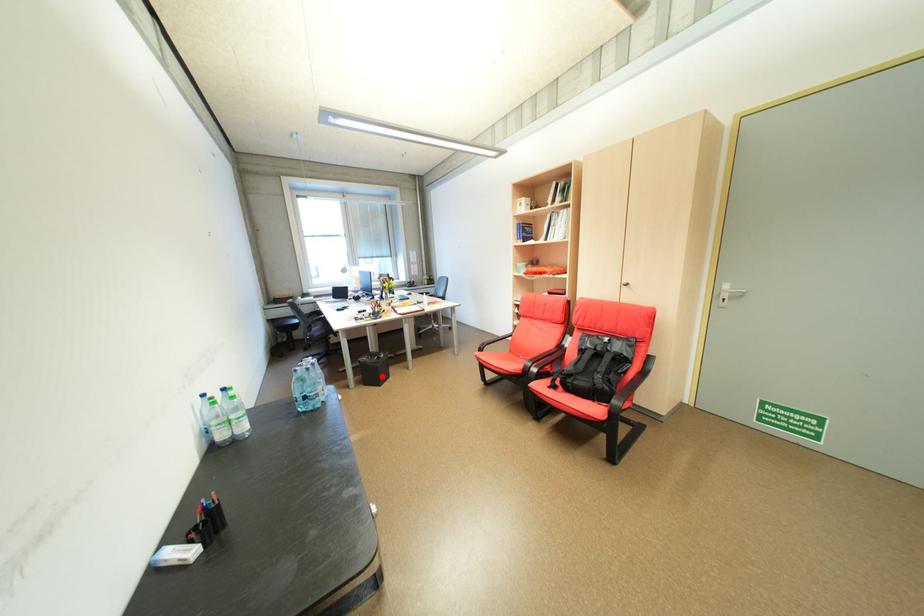
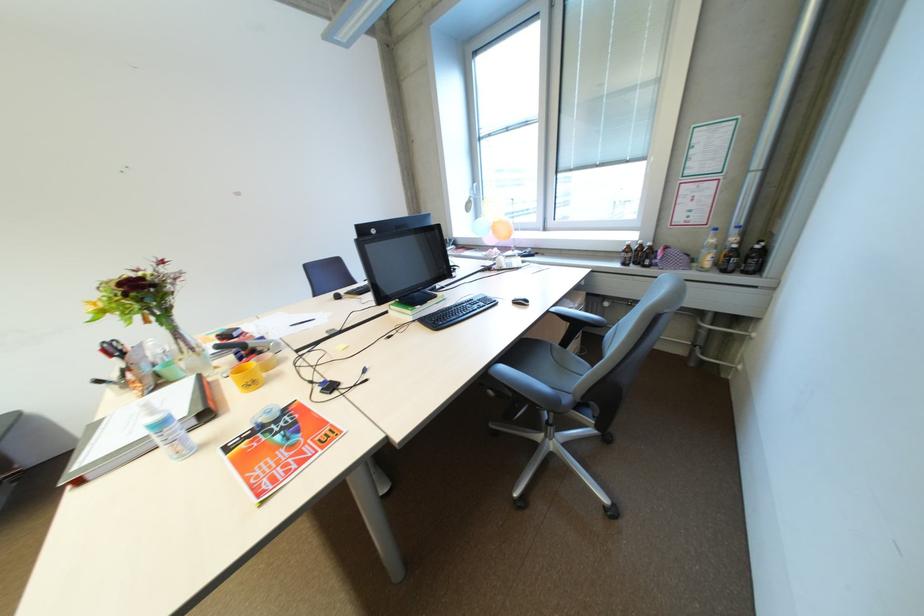
Question: I am providing you with two images of the same scene from different viewpoints. A red point is marked on the first image. At the location where the point appears in image 1, is it still visible in image 2?

Choices:
 (A) Yes
 (B) No

Answer: (B)